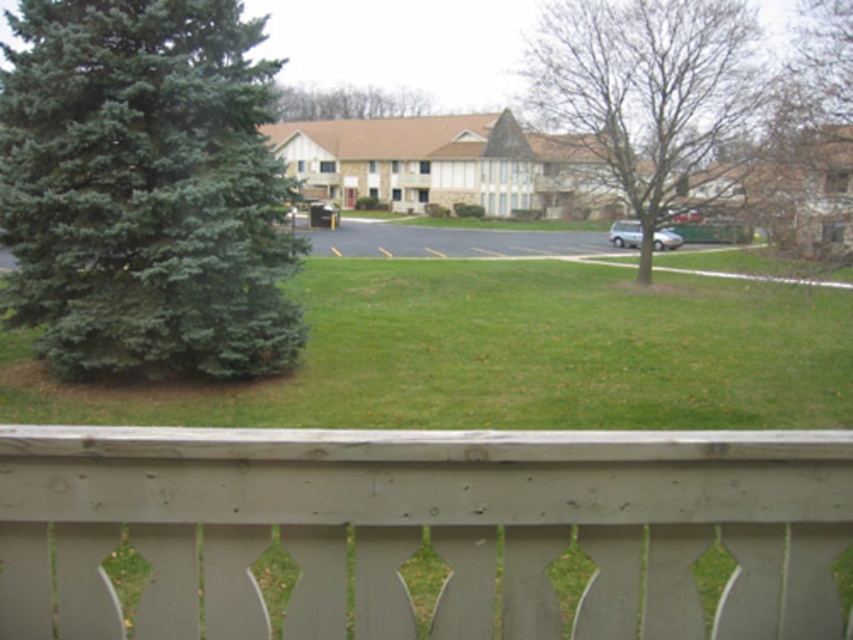
Is bare wood tree at center positioned behind green leafy tree at upper center?

No, bare wood tree at center is closer to the viewer.

Who is shorter, bare wood tree at center or green leafy tree at upper center?

With less height is green leafy tree at upper center.

Locate an element on the screen. The height and width of the screenshot is (640, 853). bare wood tree at center is located at coordinates (651, 97).

At what (x,y) coordinates should I click in order to perform the action: click on bare wood tree at center. Please return your answer as a coordinate pair (x, y). Looking at the image, I should click on (651, 97).

Which of these two, gray wood fence at lower center or green matte evergreen tree at left, stands taller?

With more height is green matte evergreen tree at left.

Looking at this image, can you confirm if gray wood fence at lower center is thinner than green matte evergreen tree at left?

Indeed, gray wood fence at lower center has a lesser width compared to green matte evergreen tree at left.

Which is in front, point (614, 586) or point (171, 188)?

Point (614, 586) is more forward.

Image resolution: width=853 pixels, height=640 pixels. Find the location of `gray wood fence at lower center`. gray wood fence at lower center is located at coordinates (421, 529).

Does gray wood fence at lower center appear under green leafy tree at upper center?

Yes, gray wood fence at lower center is below green leafy tree at upper center.

Is point (281, 525) positioned after point (425, 100)?

That is False.

Who is more distant from viewer, (381, 486) or (376, 106)?

The point (376, 106) is behind.

Where is `gray wood fence at lower center`? The height and width of the screenshot is (640, 853). gray wood fence at lower center is located at coordinates (421, 529).